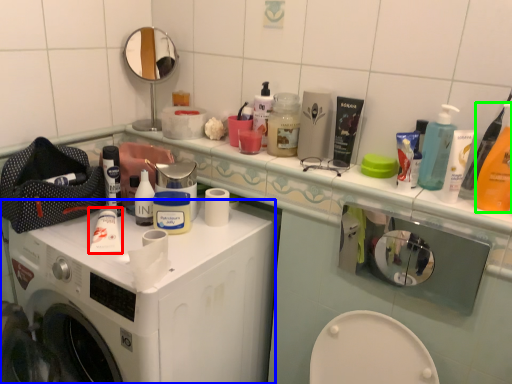
Question: Which object is the closest to the toothpaste (highlighted by a red box)? Choose among these: washing machine (highlighted by a blue box) or cleaning product (highlighted by a green box).

Choices:
 (A) washing machine
 (B) cleaning product

Answer: (A)